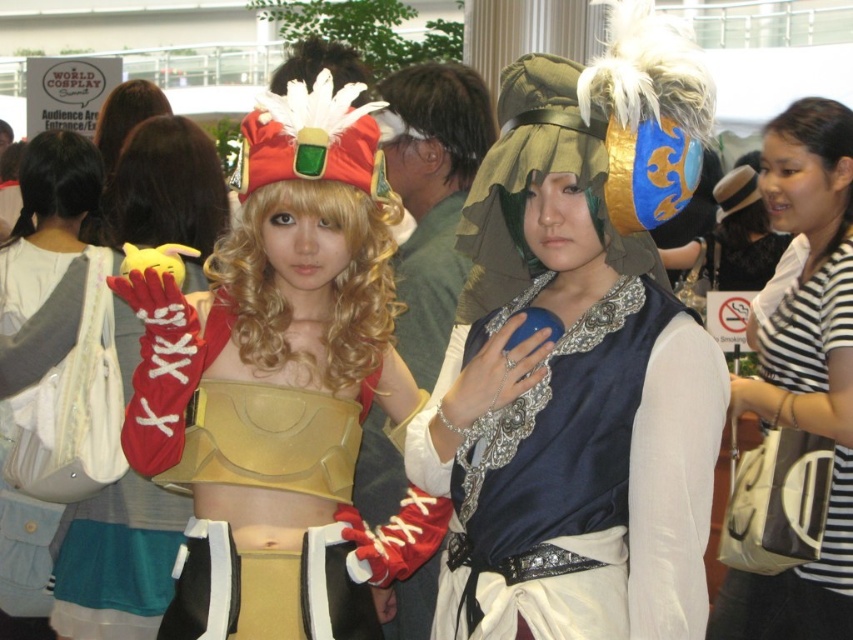
Question: Which point is closer to the camera?

Choices:
 (A) (310, 241)
 (B) (405, 172)
 (C) (526, 504)

Answer: (C)

Question: In this image, where is camouflage fabric headdress at center located relative to white fabric bag at left?

Choices:
 (A) right
 (B) left

Answer: (A)

Question: Which of the following is the closest to the observer?

Choices:
 (A) (834, 288)
 (B) (399, 362)
 (C) (474, 256)

Answer: (C)

Question: Does red leather glove at left appear over white fabric bag at left?

Choices:
 (A) no
 (B) yes

Answer: (B)

Question: Is matte gold armor at center further to the viewer compared to white striped shirt at center?

Choices:
 (A) no
 (B) yes

Answer: (A)

Question: Which object appears farthest from the camera in this image?

Choices:
 (A) white striped shirt at center
 (B) red leather glove at left
 (C) satin blue dress at center

Answer: (B)